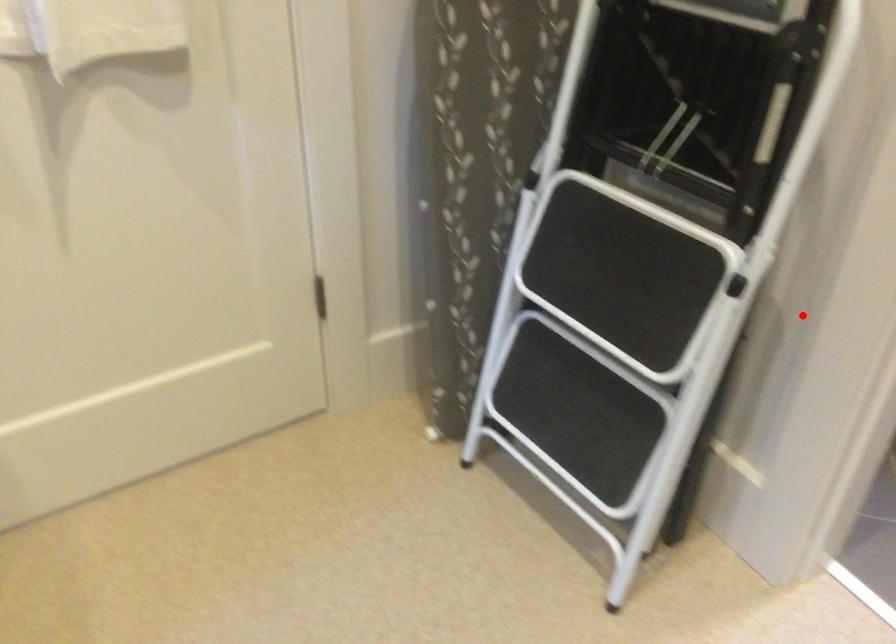
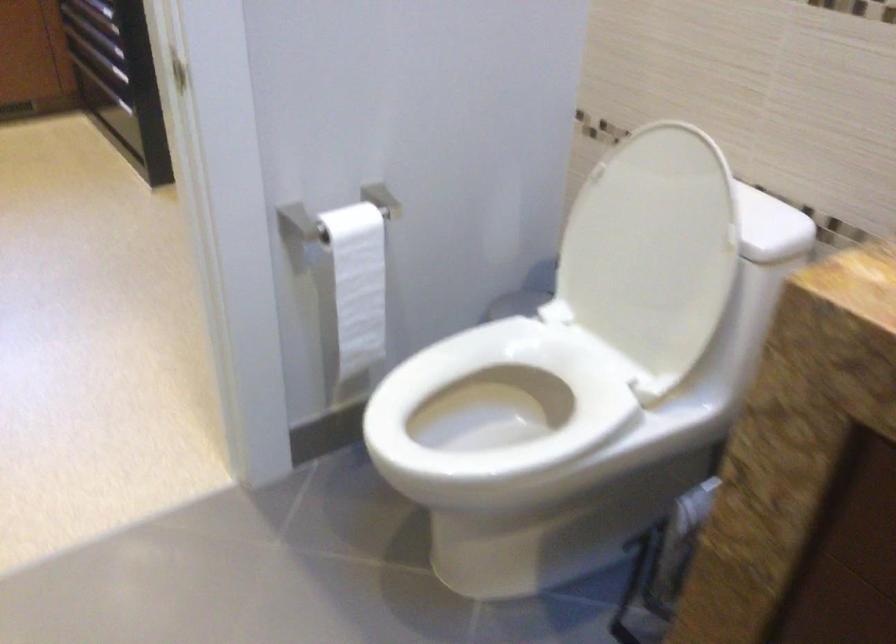
The point at the highlighted location is marked in the first image. Where is the corresponding point in the second image?

(357, 283)